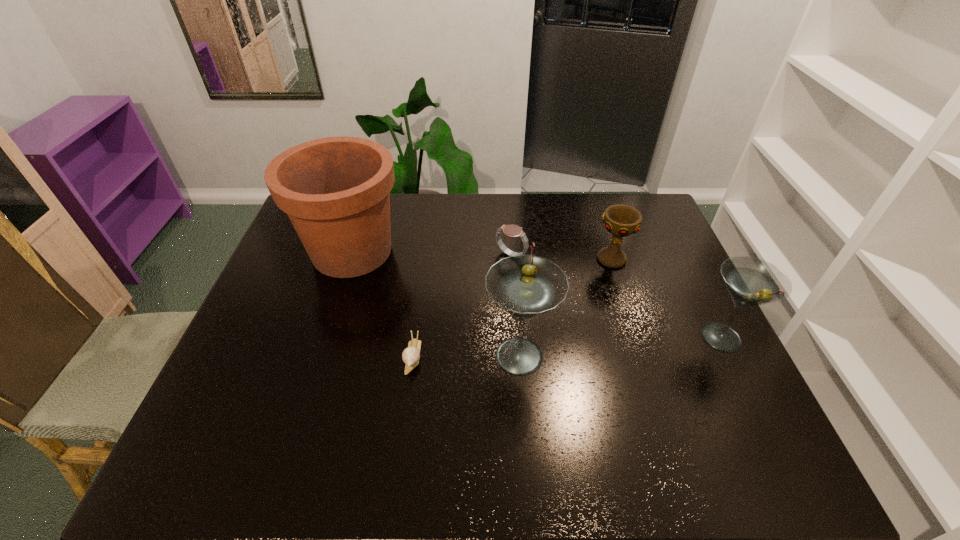
Identify the location of the left martini. (526, 286).

This screenshot has height=540, width=960. In order to click on the right martini in this screenshot , I will do `click(750, 281)`.

Locate an element on the screen. The width and height of the screenshot is (960, 540). the third tallest object is located at coordinates click(x=750, y=281).

Where is `flowerpot`? The image size is (960, 540). flowerpot is located at coordinates (336, 190).

The image size is (960, 540). I want to click on watch, so pos(513,231).

Where is `chalice`? This screenshot has width=960, height=540. chalice is located at coordinates (620, 220).

The image size is (960, 540). What are the coordinates of `the second object from right to left` in the screenshot? It's located at (620, 220).

Where is `escargot`? This screenshot has height=540, width=960. escargot is located at coordinates (411, 355).

Where is `the second object from left to right`? the second object from left to right is located at coordinates (411, 355).

You are a GUI agent. You are given a task and a screenshot of the screen. Output one action in this format:
    pyautogui.click(x=<x>, y=<y>)
    Task: Click on the free location located on the left of the left martini
    
    Given the screenshot: What is the action you would take?
    pyautogui.click(x=433, y=355)